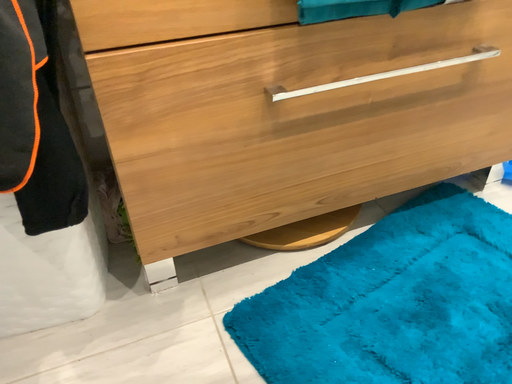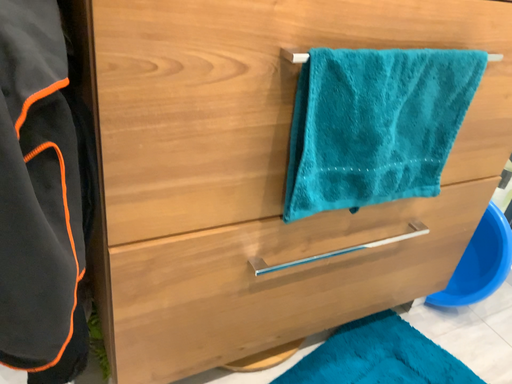
Question: How did the camera likely rotate when shooting the video?

Choices:
 (A) rotated right
 (B) rotated left

Answer: (A)